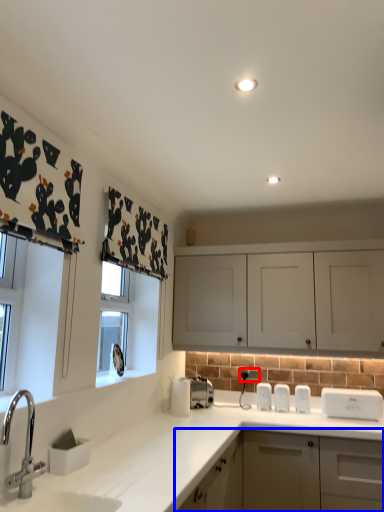
Question: Which of the following is the closest to the observer, electric outlet (highlighted by a red box) or cabinetry (highlighted by a blue box)?

Choices:
 (A) electric outlet
 (B) cabinetry

Answer: (B)